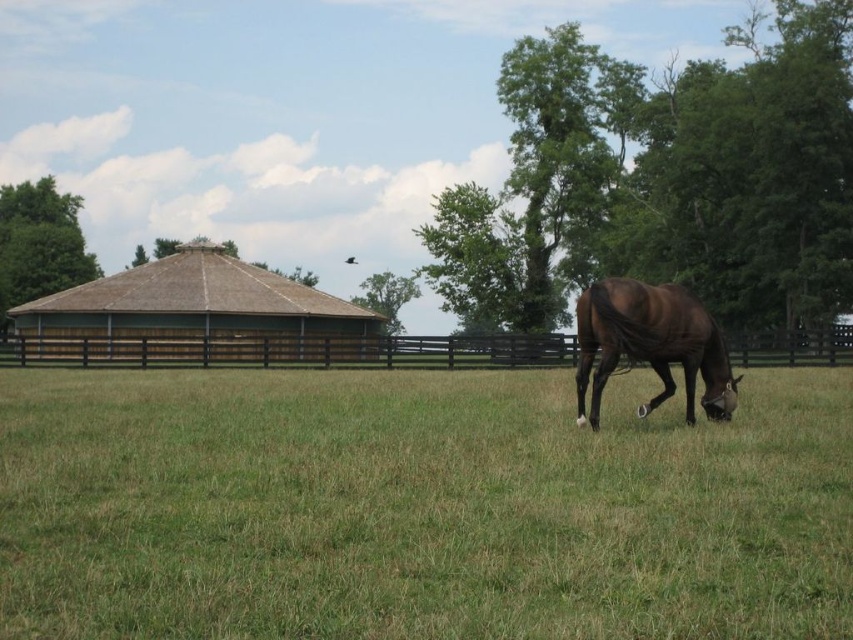
Question: In this image, where is brown wooden fence at upper left located relative to green leafy tree at center?

Choices:
 (A) above
 (B) below

Answer: (A)

Question: Which of the following is the closest to the observer?

Choices:
 (A) (202, 392)
 (B) (314, 330)
 (C) (384, 305)

Answer: (A)

Question: Estimate the real-world distances between objects in this image. Which object is farther from the green leafy tree at center?

Choices:
 (A) brown wooden fence at upper left
 (B) green leafy tree at upper left
 (C) green leafy tree at upper right
 (D) green grass at lower right

Answer: (D)

Question: Which object appears farthest from the camera in this image?

Choices:
 (A) brown wooden fence at upper left
 (B) green grass at lower right
 (C) green leafy tree at upper right

Answer: (C)

Question: Is green grass at lower right closer to the viewer compared to green leafy tree at upper left?

Choices:
 (A) no
 (B) yes

Answer: (B)

Question: From the image, what is the correct spatial relationship of green grass at lower right in relation to brown wooden fence at upper left?

Choices:
 (A) right
 (B) left

Answer: (A)